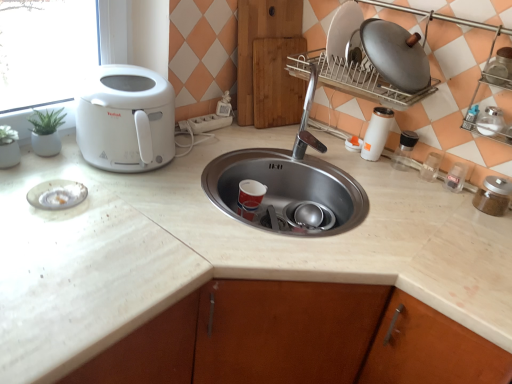
At what (x,y) coordinates should I click in order to perform the action: click on space that is in front of brown glass jar at right, the 8th appliance positioned from the left. Please return your answer as a coordinate pair (x, y). Looking at the image, I should click on (x=486, y=225).